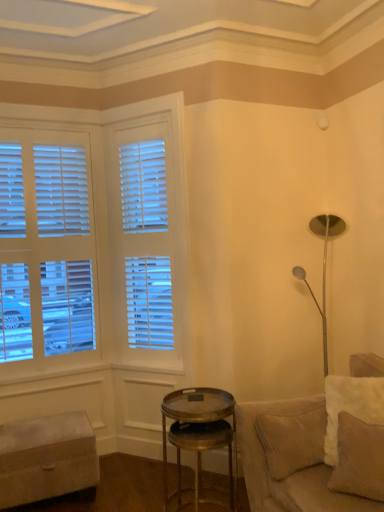
Question: Is beige leather couch at lower right facing away from beige fabric pillow at lower right?

Choices:
 (A) no
 (B) yes

Answer: (B)

Question: From a real-world perspective, is beige leather couch at lower right positioned under beige fabric pillow at lower right based on gravity?

Choices:
 (A) yes
 (B) no

Answer: (A)

Question: Is beige leather couch at lower right touching beige fabric pillow at lower right?

Choices:
 (A) no
 (B) yes

Answer: (A)

Question: Considering the relative sizes of beige leather couch at lower right and beige fabric pillow at lower right in the image provided, is beige leather couch at lower right taller than beige fabric pillow at lower right?

Choices:
 (A) yes
 (B) no

Answer: (A)

Question: Does beige leather couch at lower right have a lesser width compared to beige fabric pillow at lower right?

Choices:
 (A) yes
 (B) no

Answer: (B)

Question: Visually, is beige leather couch at lower right positioned to the left or to the right of beige fabric pillow at lower right?

Choices:
 (A) left
 (B) right

Answer: (B)

Question: Is beige leather couch at lower right inside or outside of beige fabric pillow at lower right?

Choices:
 (A) outside
 (B) inside

Answer: (A)

Question: Is beige leather couch at lower right bigger or smaller than beige fabric pillow at lower right?

Choices:
 (A) small
 (B) big

Answer: (B)

Question: In the image, is beige leather couch at lower right positioned in front of or behind beige fabric pillow at lower right?

Choices:
 (A) front
 (B) behind

Answer: (A)

Question: Is beige fabric ottoman at lower left situated inside beige leather couch at lower right or outside?

Choices:
 (A) outside
 (B) inside

Answer: (A)

Question: From their relative heights in the image, would you say beige fabric ottoman at lower left is taller or shorter than beige leather couch at lower right?

Choices:
 (A) short
 (B) tall

Answer: (A)

Question: From the image's perspective, relative to beige leather couch at lower right, is beige fabric ottoman at lower left above or below?

Choices:
 (A) below
 (B) above

Answer: (A)

Question: Is beige fabric ottoman at lower left wider or thinner than beige leather couch at lower right?

Choices:
 (A) wide
 (B) thin

Answer: (B)

Question: Looking at their shapes, would you say beige fabric pillow at lower right is wider or thinner than gold metallic side table at center?

Choices:
 (A) thin
 (B) wide

Answer: (A)

Question: Is beige fabric pillow at lower right spatially inside gold metallic side table at center, or outside of it?

Choices:
 (A) inside
 (B) outside

Answer: (B)